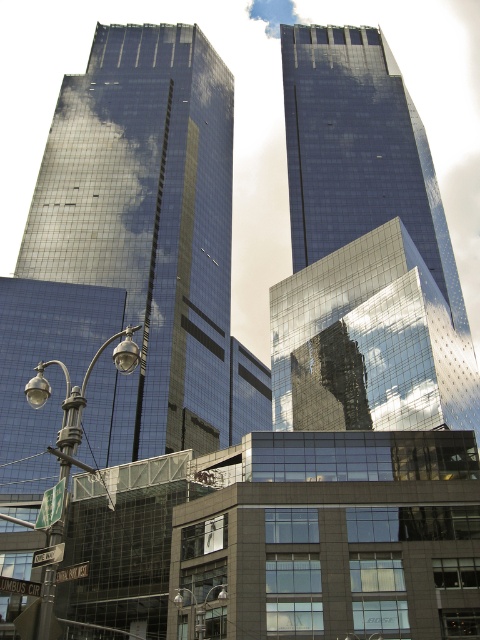
Is point (307, 188) more distant than point (59, 525)?

Yes.

Which is in front, point (317, 90) or point (72, 408)?

Point (72, 408) is more forward.

What do you see at coordinates (359, 150) in the screenshot? I see `shiny glass skyscraper at upper center` at bounding box center [359, 150].

Locate an element on the screen. shiny glass skyscraper at upper center is located at coordinates (359, 150).

Between shiny glass skyscraper at center and polished metal streetlight at lower left, which one is positioned lower?

polished metal streetlight at lower left is lower down.

Is shiny glass skyscraper at center above polished metal streetlight at lower left?

Correct, shiny glass skyscraper at center is located above polished metal streetlight at lower left.

Who is more distant from viewer, (213,122) or (61,445)?

Point (213,122)

In order to click on shiny glass skyscraper at center in this screenshot , I will do `click(147, 221)`.

From the picture: Does shiny glass skyscraper at center have a larger size compared to metallic silver streetlight at lower center?

Yes, shiny glass skyscraper at center is bigger than metallic silver streetlight at lower center.

Between shiny glass skyscraper at center and metallic silver streetlight at lower center, which one has more height?

Standing taller between the two is shiny glass skyscraper at center.

Measure the distance between shiny glass skyscraper at center and camera.

101.66 meters

Locate an element on the screen. shiny glass skyscraper at center is located at coordinates (147, 221).